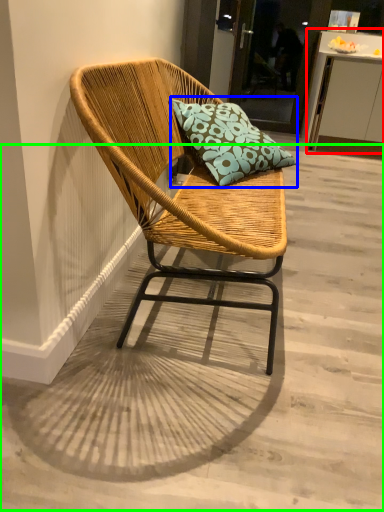
Question: Which object is positioned closest to table (highlighted by a red box)? Select from pillow (highlighted by a blue box) and concrete (highlighted by a green box).

Choices:
 (A) pillow
 (B) concrete

Answer: (A)